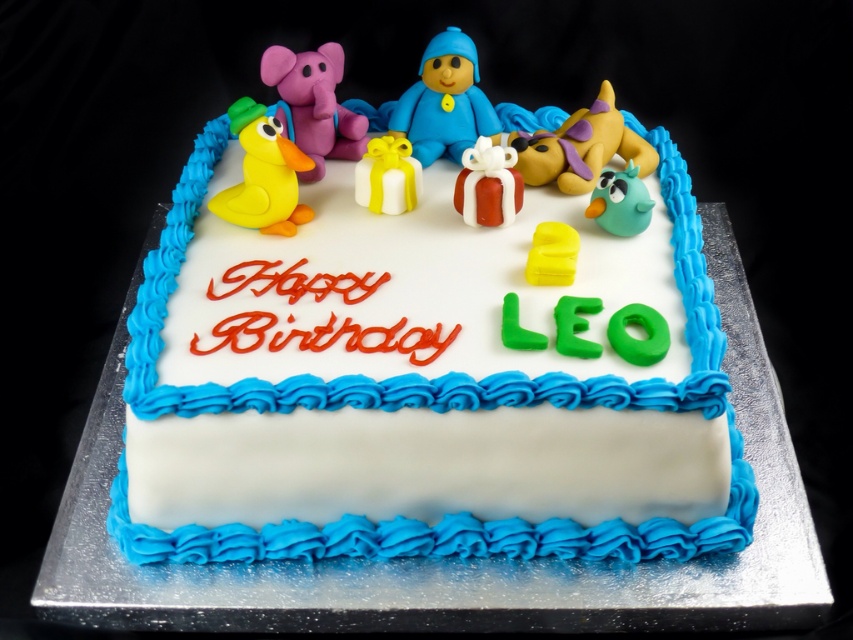
Question: Is white smooth frosting at bottom to the right of teal matte bird at upper right from the viewer's perspective?

Choices:
 (A) no
 (B) yes

Answer: (A)

Question: Which point is closer to the camera?

Choices:
 (A) rubber duck at upper left
 (B) teal matte bird at upper right

Answer: (A)

Question: Among these objects, which one is nearest to the camera?

Choices:
 (A) yellow matte toy at center
 (B) blue matte figure at center
 (C) matte purple elephant at upper left
 (D) rubber duck at upper left

Answer: (A)

Question: Which point is farther to the camera?

Choices:
 (A) white smooth frosting at bottom
 (B) shiny red gift at center

Answer: (B)

Question: Is white fondant cake at center smaller than rubber duck at upper left?

Choices:
 (A) yes
 (B) no

Answer: (B)

Question: Does matte purple elephant at upper left lie behind yellow matte dog at upper center?

Choices:
 (A) no
 (B) yes

Answer: (A)